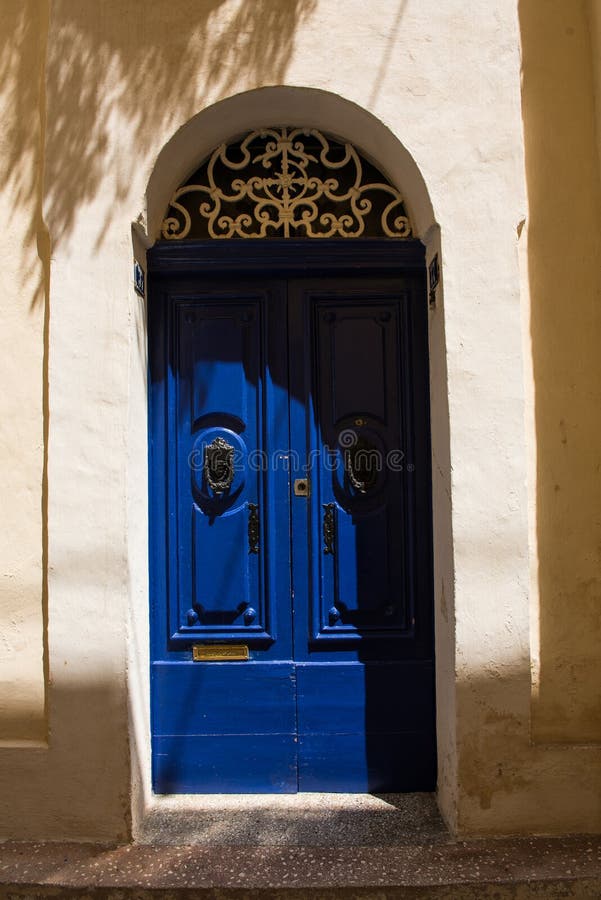
At what (x,y) coordinates should I click in order to perform the action: click on peephole. Please return your answer as a coordinate pair (x, y). The width and height of the screenshot is (601, 900). Looking at the image, I should click on (299, 487).